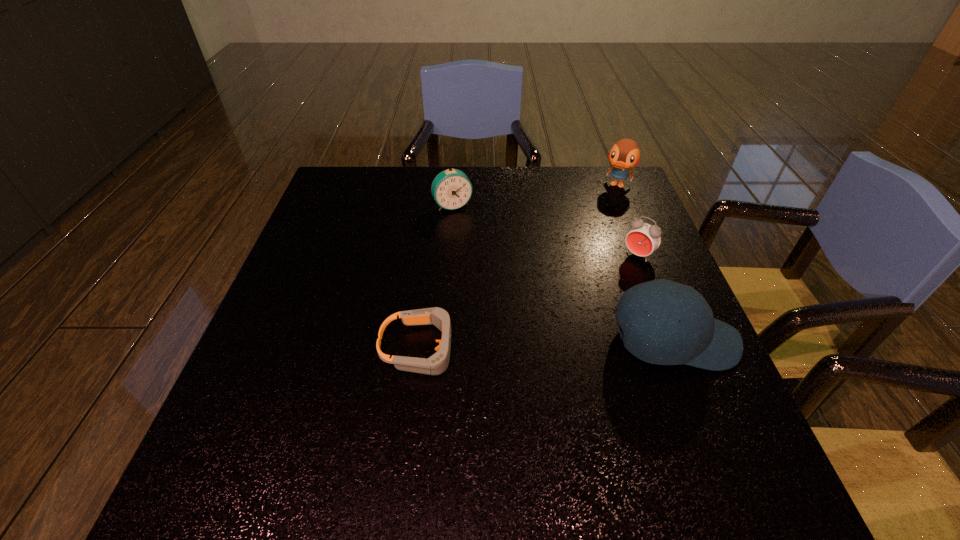
This screenshot has height=540, width=960. In order to click on empty space that is in between the baseball cap and the duck in this screenshot , I will do `click(645, 264)`.

At what (x,y) coordinates should I click in order to perform the action: click on free area in between the goggles and the third farthest object. Please return your answer as a coordinate pair (x, y). Looking at the image, I should click on (530, 302).

The width and height of the screenshot is (960, 540). Identify the location of vacant space that is in between the left alarm clock and the third farthest object. (545, 231).

I want to click on free point between the duck and the right alarm clock, so click(x=628, y=220).

The height and width of the screenshot is (540, 960). What are the coordinates of `free spot between the farther alarm clock and the baseball cap` in the screenshot? It's located at (563, 274).

Where is `free spot between the shortest object and the third farthest object`? This screenshot has width=960, height=540. free spot between the shortest object and the third farthest object is located at coordinates pyautogui.click(x=530, y=302).

The width and height of the screenshot is (960, 540). In order to click on blank region between the farthest object and the right alarm clock in this screenshot , I will do `click(628, 220)`.

At what (x,y) coordinates should I click in order to perform the action: click on object that is the second closest to the baseball cap. Please return your answer as a coordinate pair (x, y). Looking at the image, I should click on [x=436, y=364].

At what (x,y) coordinates should I click in order to perform the action: click on the fourth closest object to the left alarm clock. Please return your answer as a coordinate pair (x, y). Image resolution: width=960 pixels, height=540 pixels. Looking at the image, I should click on (656, 336).

Locate an element on the screen. free spot that satisfies the following two spatial constraints: 1. on the back side of the duck; 2. on the right side of the fourth nearest object is located at coordinates pyautogui.click(x=454, y=185).